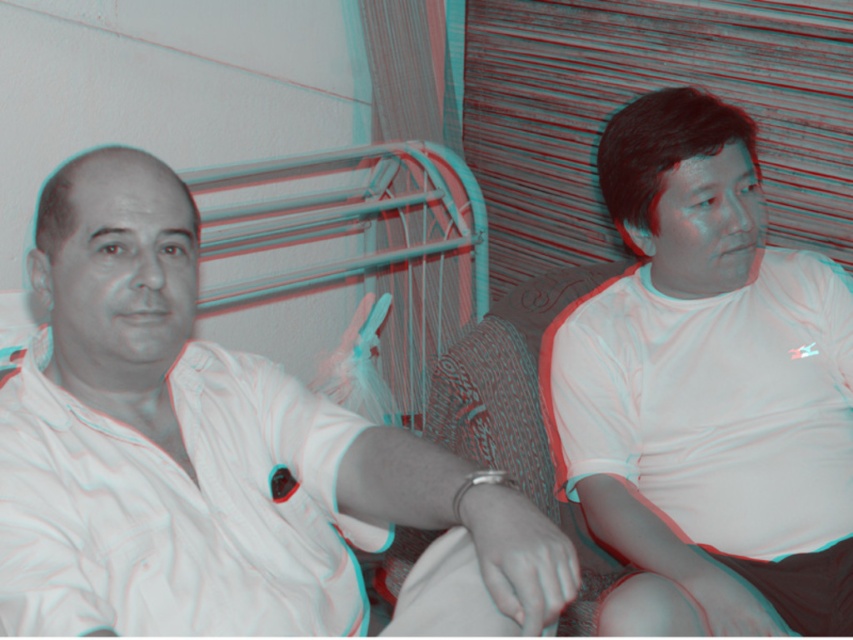
Can you confirm if white matte shirt at left is thinner than white cotton shirt at right?

No, white matte shirt at left is not thinner than white cotton shirt at right.

At what (x,y) coordinates should I click in order to perform the action: click on white matte shirt at left. Please return your answer as a coordinate pair (x, y). Looking at the image, I should click on (218, 460).

Is point (167, 540) positioned in front of point (601, 428)?

Yes, point (167, 540) is closer to viewer.

At what (x,y) coordinates should I click in order to perform the action: click on white matte shirt at left. Please return your answer as a coordinate pair (x, y). The height and width of the screenshot is (640, 853). Looking at the image, I should click on pos(218,460).

Who is positioned more to the right, white matte shirt at left or white matte polo shirt at left?

white matte shirt at left

Does point (158, 477) lie behind point (184, 512)?

No, (158, 477) is in front of (184, 512).

What are the coordinates of `white matte shirt at left` in the screenshot? It's located at (218, 460).

Between white cotton shirt at right and white matte polo shirt at left, which one appears on the right side from the viewer's perspective?

Positioned to the right is white cotton shirt at right.

Does white cotton shirt at right come behind white matte polo shirt at left?

Yes.

Between point (836, 582) and point (291, 493), which one is positioned behind?

The point (836, 582) is behind.

At what (x,y) coordinates should I click in order to perform the action: click on white cotton shirt at right. Please return your answer as a coordinate pair (x, y). Looking at the image, I should click on (706, 392).